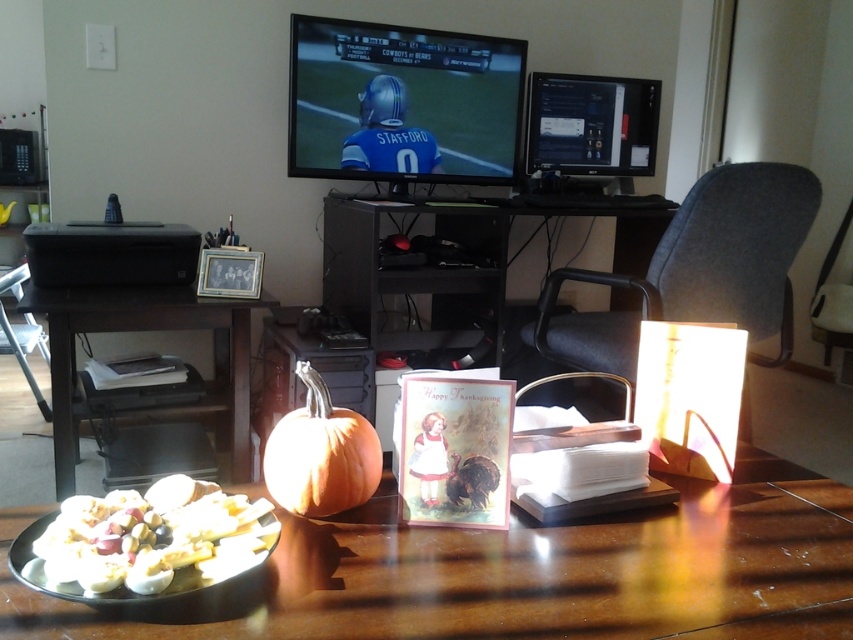
Question: Can you confirm if black fabric chair at center is positioned above orange matte pumpkin at center?

Choices:
 (A) yes
 (B) no

Answer: (A)

Question: Which point is farther from the camera taking this photo?

Choices:
 (A) (790, 352)
 (B) (570, 556)
 (C) (486, 228)
 (D) (70, 324)

Answer: (C)

Question: Can you confirm if wooden table at center is positioned to the right of black fabric chair at center?

Choices:
 (A) no
 (B) yes

Answer: (A)

Question: Which object is the closest to the black plastic entertainment center at center?

Choices:
 (A) wooden table at center
 (B) orange matte pumpkin at center

Answer: (A)

Question: Is black fabric chair at center bigger than white cheese at lower left?

Choices:
 (A) yes
 (B) no

Answer: (A)

Question: Which object appears farthest from the camera in this image?

Choices:
 (A) black fabric chair at center
 (B) dark brown wood table at left
 (C) orange matte pumpkin at center

Answer: (A)